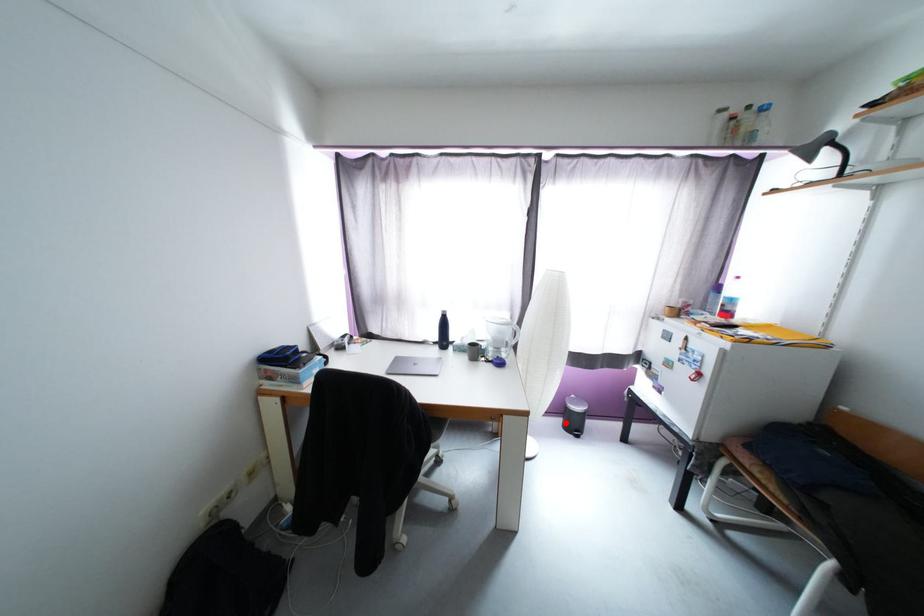
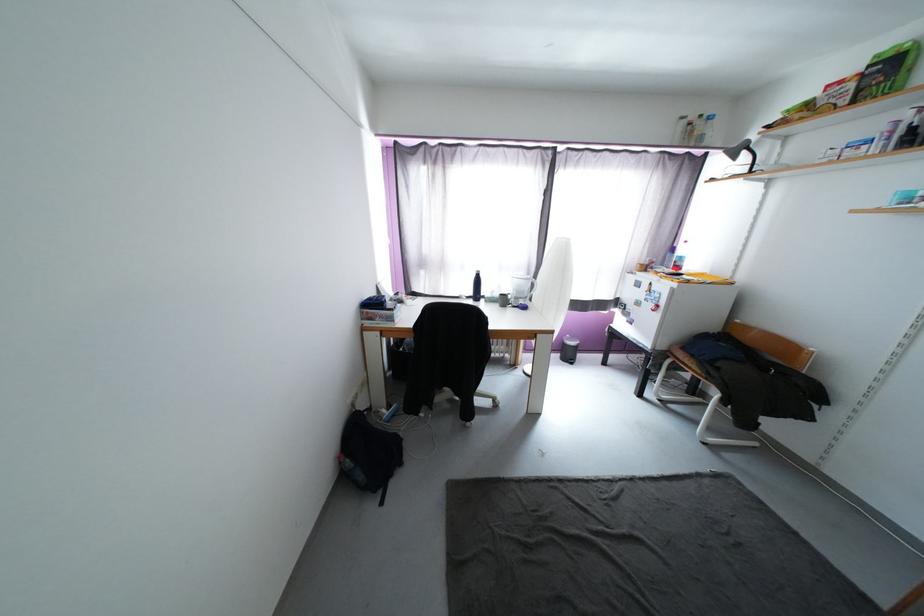
Question: I am providing you with two images of the same scene from different viewpoints. Given a red point in image1, look at the same physical point in image2. Is it:

Choices:
 (A) Closer to the viewpoint
 (B) Farther from the viewpoint

Answer: (B)